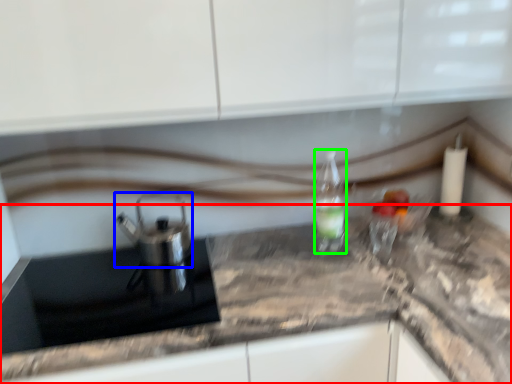
Question: Which object is positioned farthest from countertop (highlighted by a red box)? Select from tea pot (highlighted by a blue box) and bottle (highlighted by a green box).

Choices:
 (A) tea pot
 (B) bottle

Answer: (A)